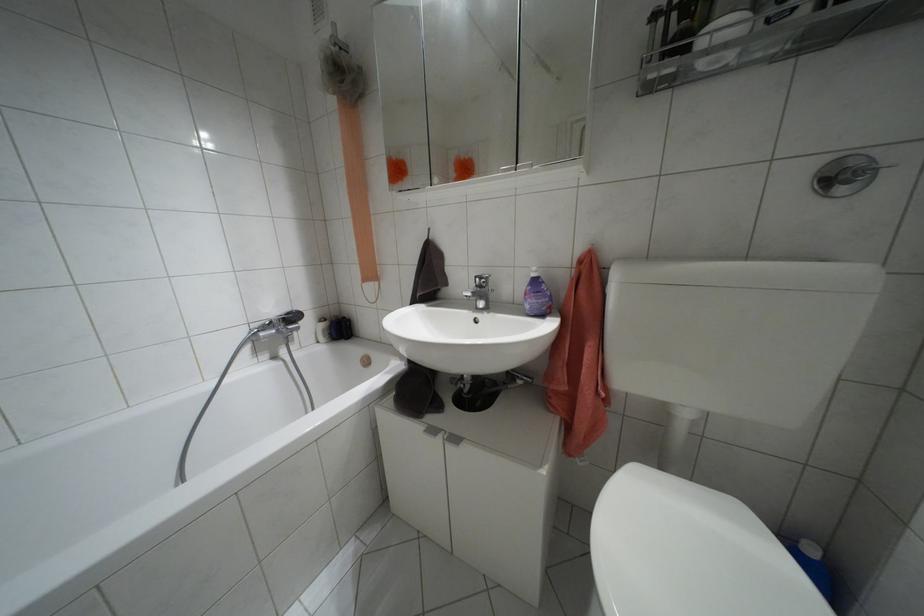
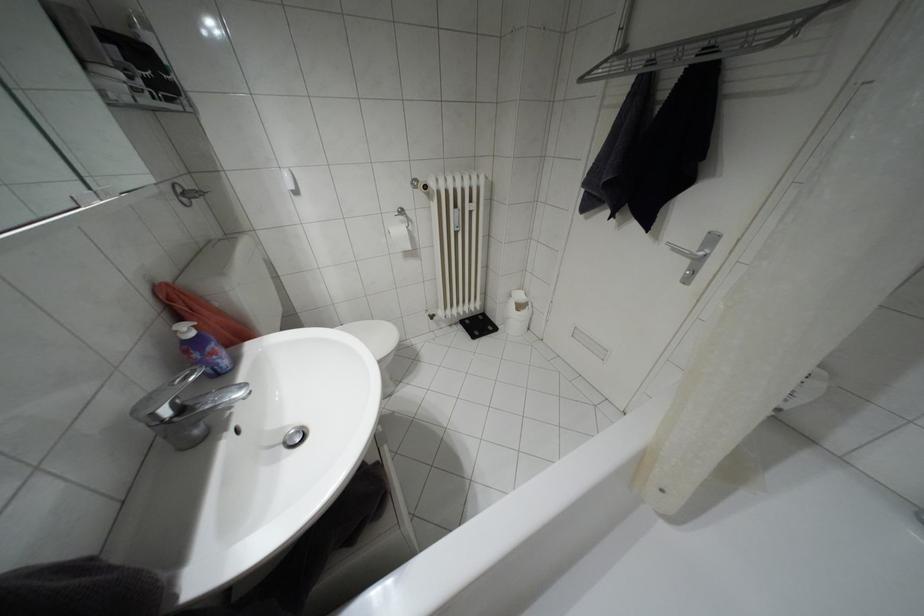
Find the pixel in the second image that matches (532,274) in the first image.

(190, 333)